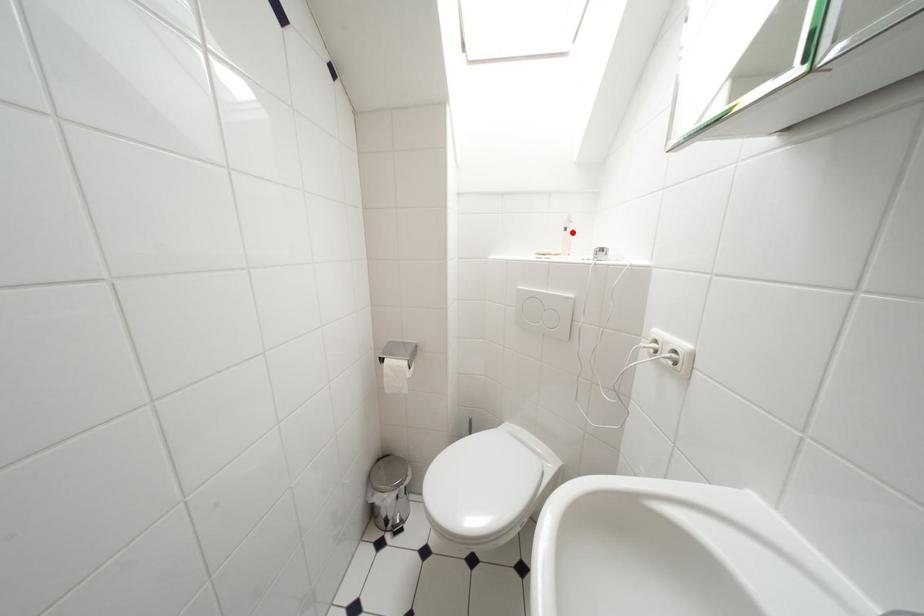
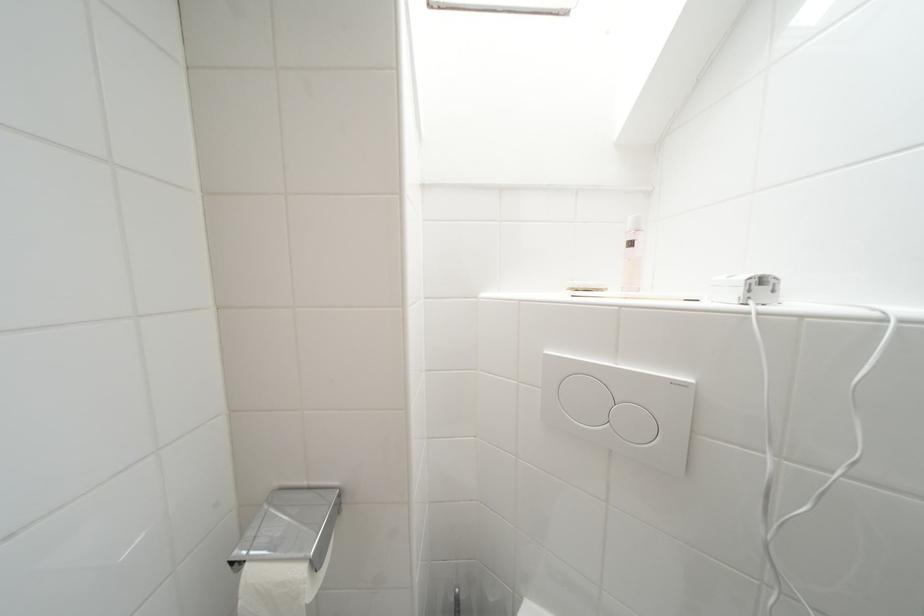
Locate, in the second image, the point that corresponds to the highlighted location in the first image.

(638, 246)